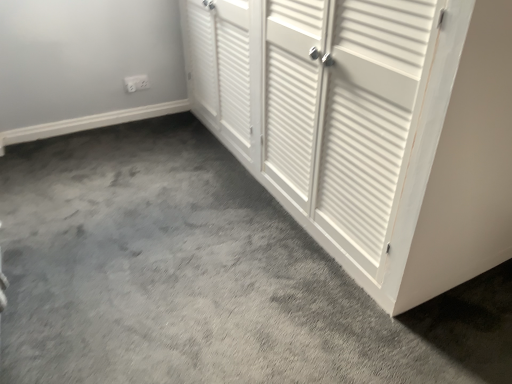
What are the coordinates of `gray carpet at center` in the screenshot? It's located at (204, 277).

This screenshot has height=384, width=512. Describe the element at coordinates (204, 277) in the screenshot. I see `gray carpet at center` at that location.

You are a GUI agent. You are given a task and a screenshot of the screen. Output one action in this format:
    pyautogui.click(x=<x>, y=<y>)
    Task: Click on the gray carpet at center
    
    Given the screenshot: What is the action you would take?
    pyautogui.click(x=204, y=277)